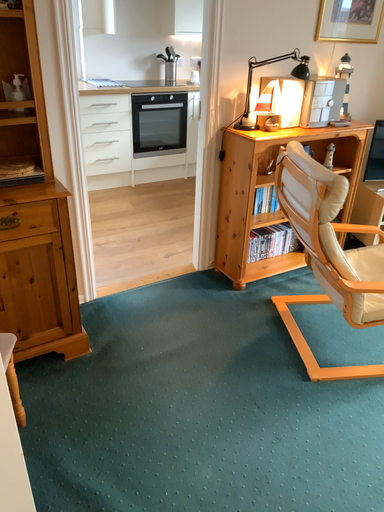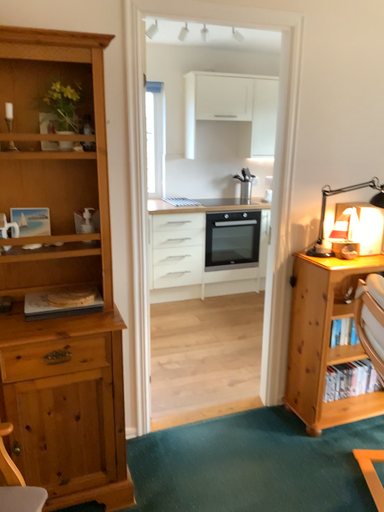
Question: How did the camera likely rotate when shooting the video?

Choices:
 (A) rotated right
 (B) rotated left

Answer: (B)